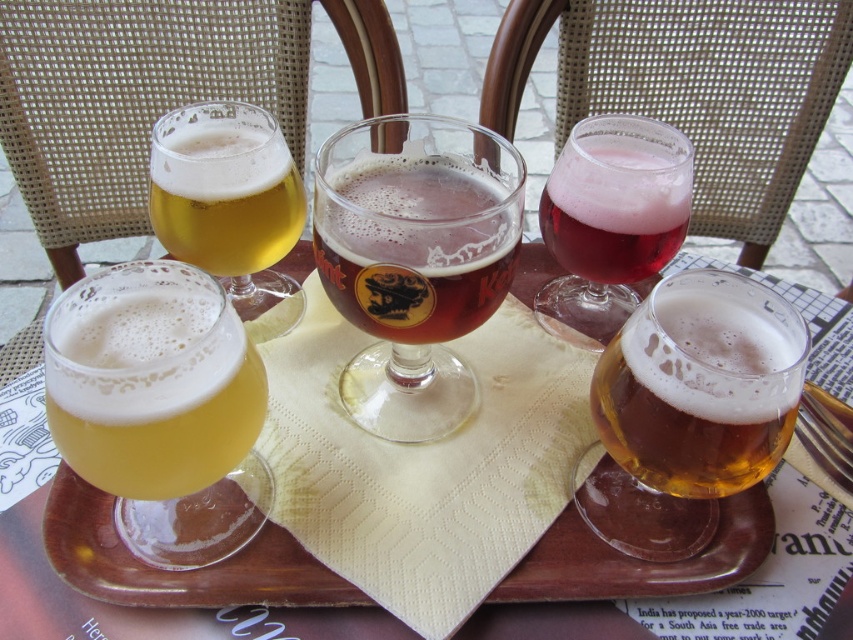
Does yellow frothy beer at lower left appear under golden glass beer at upper left?

Correct, yellow frothy beer at lower left is located below golden glass beer at upper left.

Is yellow frothy beer at lower left further to the viewer compared to golden glass beer at upper left?

No, yellow frothy beer at lower left is closer to the viewer.

Where is `yellow frothy beer at lower left`? yellow frothy beer at lower left is located at coordinates (165, 433).

Is brown glass beer at center taller than golden glass beer at upper left?

Yes, brown glass beer at center is taller than golden glass beer at upper left.

In the scene shown: Is brown glass beer at center below golden glass beer at upper left?

Indeed, brown glass beer at center is positioned under golden glass beer at upper left.

Which is in front, point (399, 230) or point (202, 248)?

Point (399, 230) is in front.

Image resolution: width=853 pixels, height=640 pixels. I want to click on brown glass beer at center, so click(x=415, y=244).

Is point (653, 253) behind point (183, 220)?

That is True.

Between point (585, 225) and point (183, 250), which one is positioned behind?

The point (585, 225) is more distant.

I want to click on pink frothy beverage at upper right, so click(614, 211).